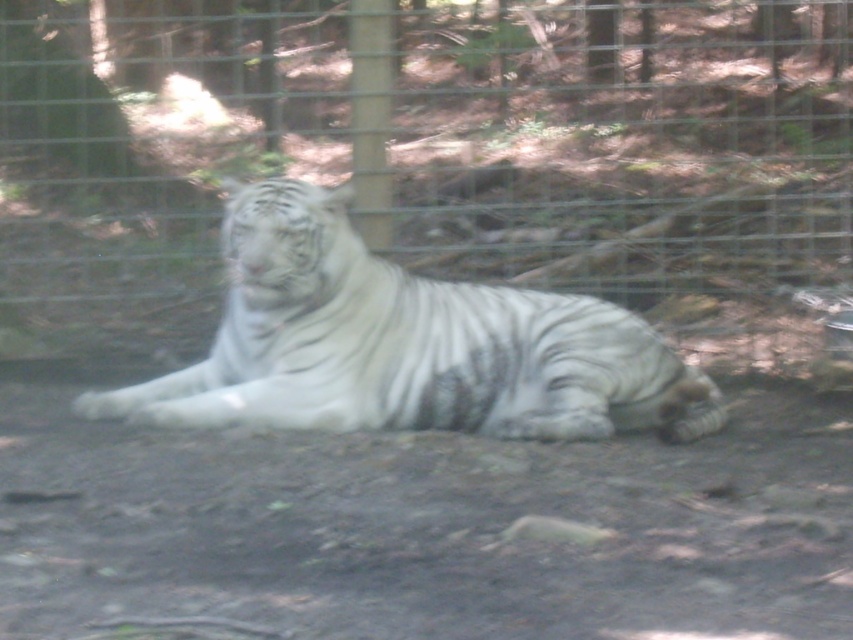
You are a zookeeper who wants to feed the white striped tiger at center. To reach the tiger, you need to cross the metal wire fence at center. Is the tiger on the same side as you, or the other side of the fence?

The white striped tiger at center is behind the metal wire fence at center, so the tiger is on the other side of the fence from you.

You are standing at the point marked as point (407, 49) in the zoo enclosure where the white tiger is resting. You want to take a photo of the tiger without getting too close. If the camera you are using has a maximum zoom range of 20 feet, will you be able to capture the tiger clearly without moving closer?

The distance between you and the white tiger is 26.00 feet, which exceeds the camera maximum zoom range of 20 feet. Therefore, you will not be able to capture the tiger clearly without moving closer.

You are a zookeeper who needs to ensure the safety of the white striped tiger at center. The enclosure has a metal wire fence at center. From the tiger, which direction should you check first to ensure the fence is secure?

The metal wire fence at center is located above the white striped tiger at center, so you should first check the area above the tiger to ensure the fence is secure.